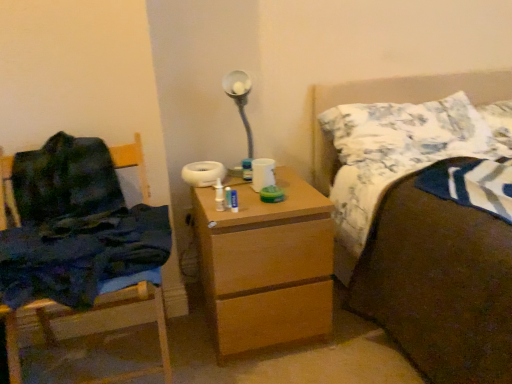
Question: Does wooden chair at left come behind wooden chest of drawers at center?

Choices:
 (A) no
 (B) yes

Answer: (A)

Question: Is wooden chair at left to the right of wooden chest of drawers at center from the viewer's perspective?

Choices:
 (A) no
 (B) yes

Answer: (A)

Question: Is wooden chair at left positioned before wooden chest of drawers at center?

Choices:
 (A) no
 (B) yes

Answer: (B)

Question: Can you confirm if wooden chair at left is bigger than wooden chest of drawers at center?

Choices:
 (A) no
 (B) yes

Answer: (B)

Question: From a real-world perspective, is wooden chair at left on top of wooden chest of drawers at center?

Choices:
 (A) no
 (B) yes

Answer: (B)

Question: Considering the positions of dark blue fabric at left and white cotton pillow at upper right, the first pillow in the right-to-left sequence, in the image, is dark blue fabric at left wider or thinner than white cotton pillow at upper right, the first pillow in the right-to-left sequence,?

Choices:
 (A) thin
 (B) wide

Answer: (B)

Question: Based on their positions, is dark blue fabric at left located to the left or right of white cotton pillow at upper right, the first pillow in the right-to-left sequence?

Choices:
 (A) left
 (B) right

Answer: (A)

Question: Is dark blue fabric at left inside the boundaries of white cotton pillow at upper right, which is the second pillow from left to right, or outside?

Choices:
 (A) inside
 (B) outside

Answer: (B)

Question: Considering their positions, is dark blue fabric at left located in front of or behind white cotton pillow at upper right, which is the second pillow from left to right?

Choices:
 (A) front
 (B) behind

Answer: (A)

Question: Is wooden chest of drawers at center taller or shorter than brown fabric bed at upper right?

Choices:
 (A) tall
 (B) short

Answer: (B)

Question: From the image's perspective, is wooden chest of drawers at center located above or below brown fabric bed at upper right?

Choices:
 (A) above
 (B) below

Answer: (B)

Question: Looking at their shapes, would you say wooden chest of drawers at center is wider or thinner than brown fabric bed at upper right?

Choices:
 (A) thin
 (B) wide

Answer: (A)

Question: Considering the relative positions of wooden chest of drawers at center and brown fabric bed at upper right in the image provided, is wooden chest of drawers at center to the left or to the right of brown fabric bed at upper right?

Choices:
 (A) right
 (B) left

Answer: (B)

Question: Considering their positions, is brown fabric bed at upper right located in front of or behind white textured pillow at upper right, which ranks as the second pillow in right-to-left order?

Choices:
 (A) front
 (B) behind

Answer: (A)

Question: In terms of size, does brown fabric bed at upper right appear bigger or smaller than white textured pillow at upper right, which appears as the 1th pillow when viewed from the left?

Choices:
 (A) small
 (B) big

Answer: (B)